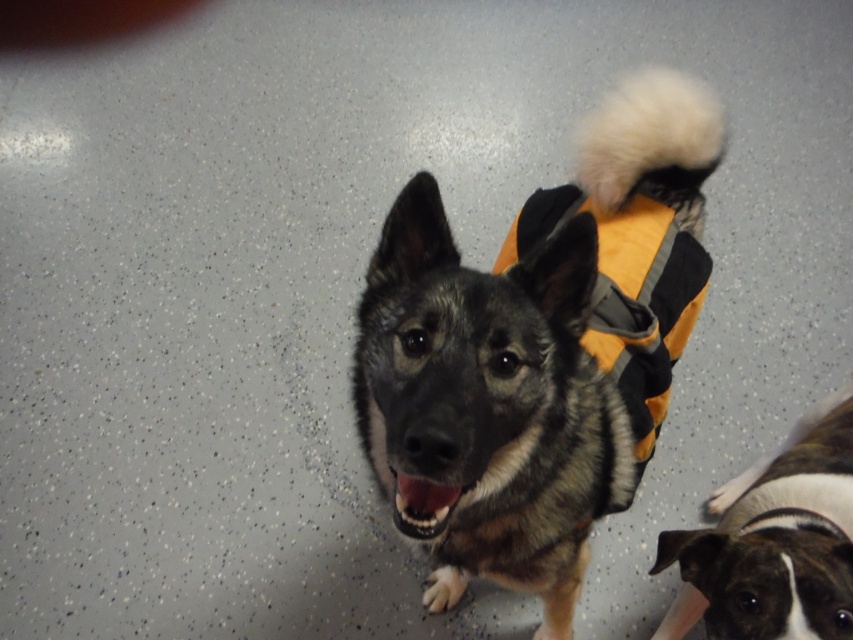
Question: Does orange fabric vest at center appear on the left side of brown and white fur at lower right?

Choices:
 (A) no
 (B) yes

Answer: (B)

Question: Which point is farther to the camera?

Choices:
 (A) (432, 218)
 (B) (750, 504)

Answer: (B)

Question: Which of the following is the closest to the observer?

Choices:
 (A) orange fabric vest at center
 (B) brown and white fur at lower right

Answer: (A)

Question: Does orange fabric vest at center lie behind brown and white fur at lower right?

Choices:
 (A) no
 (B) yes

Answer: (A)

Question: Observing the image, what is the correct spatial positioning of orange fabric vest at center in reference to brown and white fur at lower right?

Choices:
 (A) right
 (B) left

Answer: (B)